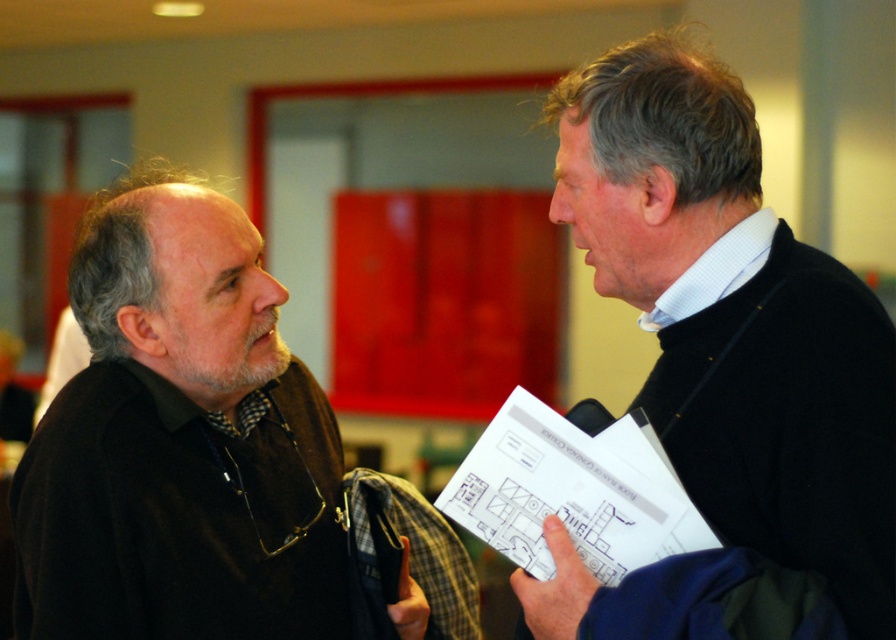
Based on the photo, you are standing in the conference room and need to locate the black matte shirt at left. According to the coordinates provided, where exactly is it positioned?

The black matte shirt at left is located at point 0.691 on the x axis and 0.201 on the y axis.

You are a photographer adjusting lighting in the room. You need to ensure that the black matte shirt at left and the white paper at center are both clearly visible. Based on their positions, which object might be more challenging to properly illuminate?

The black matte shirt at left is positioned over white paper at center, so the white paper at center might be more challenging to illuminate because it could reflect more light and cause overexposure compared to the darker shirt.

You are standing in the conference room and want to move from the point at coordinates point (756, 164) to the point at coordinates point (531, 492). Can you walk directly between these two points without any obstacles?

Point (756, 164) is behind point (531, 492), so you cannot walk directly between them without going around the obstacle in front.